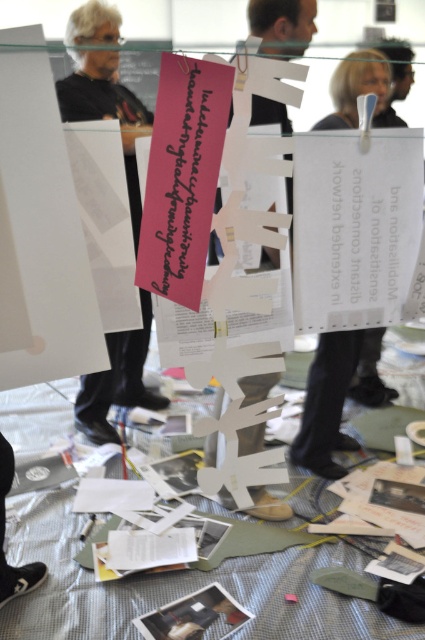
Does black matte shirt at center appear on the left side of white paper at upper center?

Yes, black matte shirt at center is to the left of white paper at upper center.

Who is positioned more to the right, black matte shirt at center or white paper at upper center?

white paper at upper center

Which is behind, point (70, 29) or point (334, 353)?

Positioned behind is point (70, 29).

The height and width of the screenshot is (640, 425). I want to click on black matte shirt at center, so click(x=107, y=112).

Between white paper at upper center and white paper at center, which one has more height?

white paper at upper center is taller.

Which is behind, point (334, 90) or point (226, 500)?

Point (226, 500)

Identify the location of white paper at upper center. The image size is (425, 640). (328, 403).

Is black matte shirt at center shorter than white paper at center?

No.

Is black matte shirt at center smaller than white paper at center?

No.

Is point (88, 413) behind point (255, 504)?

That is True.

Where is `black matte shirt at center`? The image size is (425, 640). black matte shirt at center is located at coordinates (107, 112).